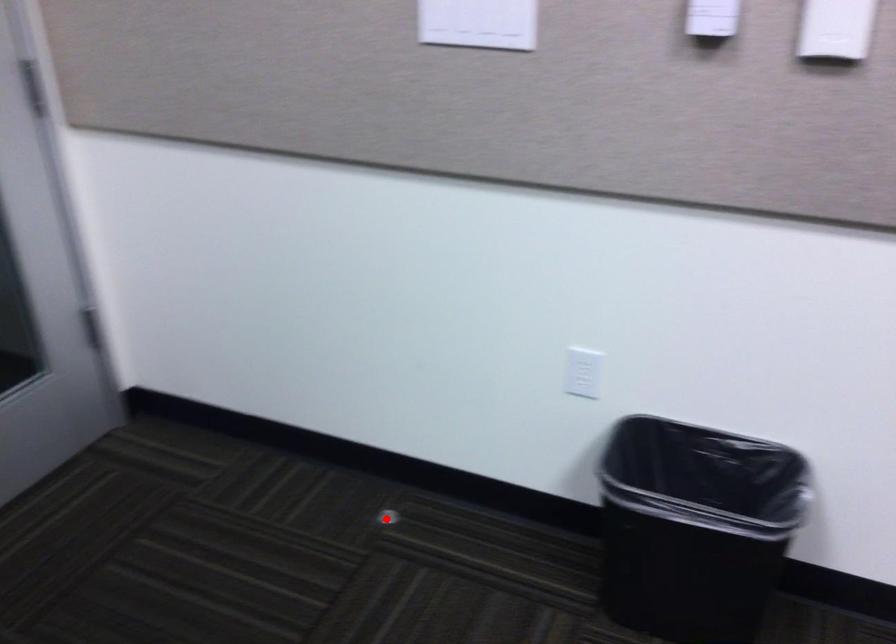
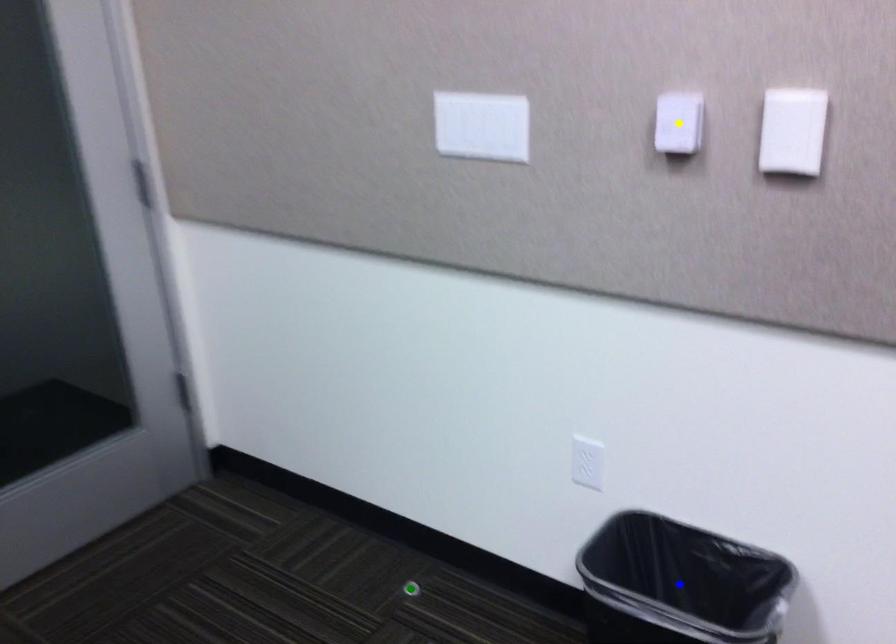
Question: I am providing you with two images of the same scene from different viewpoints. A red point is marked on the first image. You are given multiple points on the second image. Can you choose the point in image 2 that corresponds to the point in image 1?

Choices:
 (A) yellow point
 (B) green point
 (C) blue point

Answer: (B)